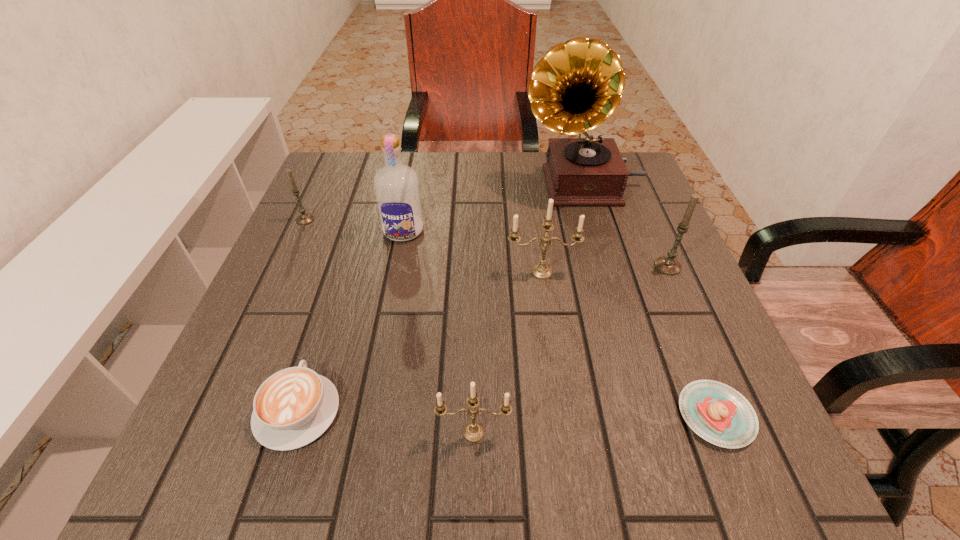
This screenshot has height=540, width=960. In order to click on the fourth object from left to right in this screenshot , I will do `click(473, 432)`.

Image resolution: width=960 pixels, height=540 pixels. I want to click on the smaller metallic candle, so click(x=473, y=432).

At what (x,y) coordinates should I click in order to perform the action: click on the seventh tallest object. Please return your answer as a coordinate pair (x, y). This screenshot has height=540, width=960. Looking at the image, I should click on (293, 407).

Locate an element on the screen. The image size is (960, 540). the seventh object from right to left is located at coordinates (293, 407).

This screenshot has height=540, width=960. What are the coordinates of `pastry` in the screenshot? It's located at (716, 412).

Locate an element on the screen. This screenshot has width=960, height=540. free region located 0.080m from the horn of the tallest object is located at coordinates (490, 185).

Where is `vacant space located 0.320m from the horn of the tallest object`? The height and width of the screenshot is (540, 960). vacant space located 0.320m from the horn of the tallest object is located at coordinates (396, 185).

The height and width of the screenshot is (540, 960). Find the location of `free space located 0.150m from the horn of the tallest object`. free space located 0.150m from the horn of the tallest object is located at coordinates (462, 185).

Locate an element on the screen. This screenshot has height=540, width=960. vacant space located on the label of the vodka is located at coordinates (390, 302).

Where is `free space located 0.130m on the left of the bigger gray candle`? free space located 0.130m on the left of the bigger gray candle is located at coordinates (592, 266).